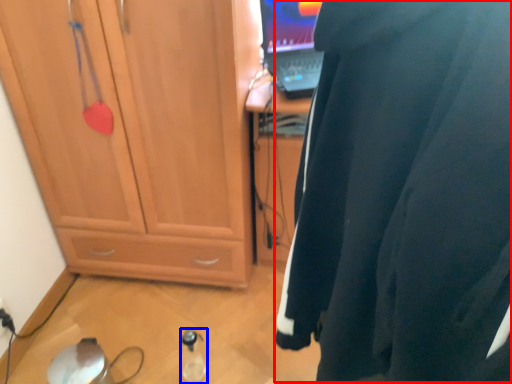
Question: Which of the following is the closest to the observer, wetsuit (highlighted by a red box) or bottle (highlighted by a blue box)?

Choices:
 (A) wetsuit
 (B) bottle

Answer: (A)